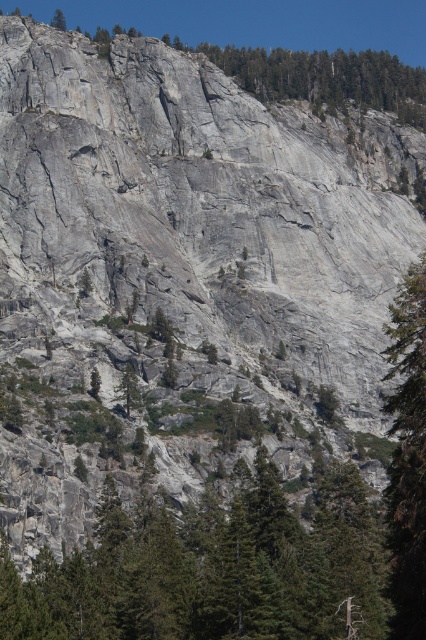
Question: Can you confirm if green matte tree at lower center is thinner than green textured tree at upper left?

Choices:
 (A) no
 (B) yes

Answer: (A)

Question: Does green matte tree at lower center appear on the left side of green textured tree at right?

Choices:
 (A) yes
 (B) no

Answer: (A)

Question: Which point is farther to the camera?

Choices:
 (A) (400, 490)
 (B) (58, 10)

Answer: (B)

Question: Which point is closer to the camera taking this photo?

Choices:
 (A) (57, 28)
 (B) (403, 372)

Answer: (B)

Question: Is green matte tree at lower center smaller than green textured tree at upper left?

Choices:
 (A) yes
 (B) no

Answer: (A)

Question: Which of these objects is positioned closest to the green textured tree at upper left?

Choices:
 (A) green textured tree at right
 (B) green matte tree at lower center

Answer: (A)